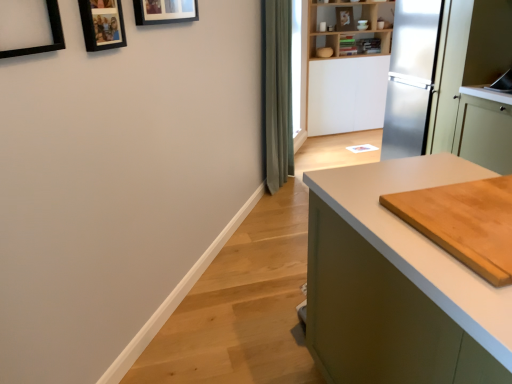
Question: Based on their sizes in the image, would you say wooden photo frame at upper left, positioned as the 2th picture frame in right-to-left order, is bigger or smaller than black matte picture frame at upper left, the 3th picture frame positioned from the right?

Choices:
 (A) small
 (B) big

Answer: (A)

Question: Would you say wooden photo frame at upper left, positioned as the 2th picture frame in front-to-back order, is inside or outside black matte picture frame at upper left, the 3th picture frame positioned from the right?

Choices:
 (A) outside
 (B) inside

Answer: (A)

Question: Estimate the real-world distances between objects in this image. Which object is closer to the wooden picture frame at upper center, which is the first picture frame from right to left?

Choices:
 (A) light brown wooden cutting board at right
 (B) wooden bookshelf at upper center
 (C) wooden cutting board at right
 (D) black matte picture frame at upper left, which is the first picture frame from front to back
 (E) green fabric curtain at center

Answer: (D)

Question: Which object is positioned closest to the wooden cutting board at right?

Choices:
 (A) wooden picture frame at upper center, which is the first picture frame from right to left
 (B) black matte picture frame at upper left, the 1th picture frame positioned from the left
 (C) green fabric curtain at center
 (D) light brown wooden cutting board at right
 (E) matte gray countertop at center

Answer: (C)